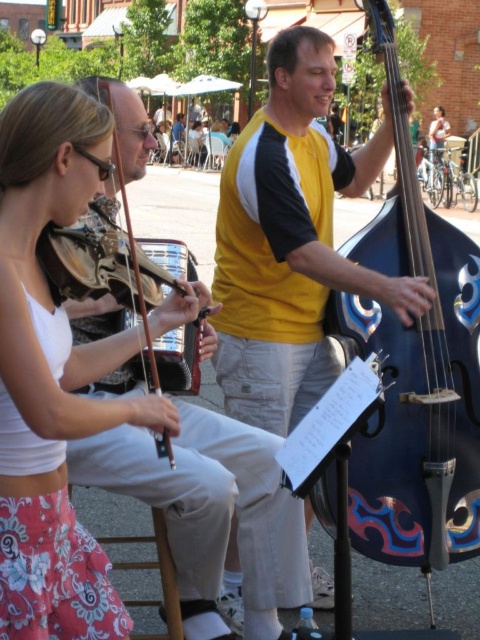
Can you confirm if yellow jersey at center is smaller than blue painted wood cello at center?

No, yellow jersey at center is not smaller than blue painted wood cello at center.

Can you confirm if yellow jersey at center is thinner than blue painted wood cello at center?

No.

Between point (410, 308) and point (469, 461), which one is positioned behind?

The point (469, 461) is more distant.

This screenshot has height=640, width=480. In order to click on yellow jersey at center in this screenshot , I will do `click(290, 241)`.

Can you confirm if blue painted wood cello at center is positioned above matte brown violin at left?

Yes.

Where is `blue painted wood cello at center`? Image resolution: width=480 pixels, height=640 pixels. blue painted wood cello at center is located at coordinates [415, 369].

Image resolution: width=480 pixels, height=640 pixels. Describe the element at coordinates (290, 241) in the screenshot. I see `yellow jersey at center` at that location.

Who is lower down, yellow jersey at center or matte brown violin at left?

yellow jersey at center is below.

Describe the element at coordinates (290, 241) in the screenshot. I see `yellow jersey at center` at that location.

The width and height of the screenshot is (480, 640). Find the location of `yellow jersey at center`. yellow jersey at center is located at coordinates (290, 241).